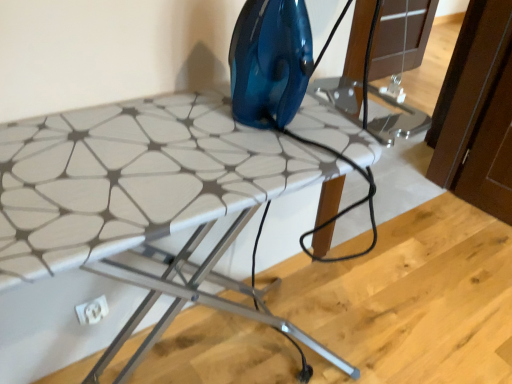
Where is `vacant space underneath white textured ironing board at center (from a real-world perspective)`? Image resolution: width=512 pixels, height=384 pixels. vacant space underneath white textured ironing board at center (from a real-world perspective) is located at coordinates (246, 353).